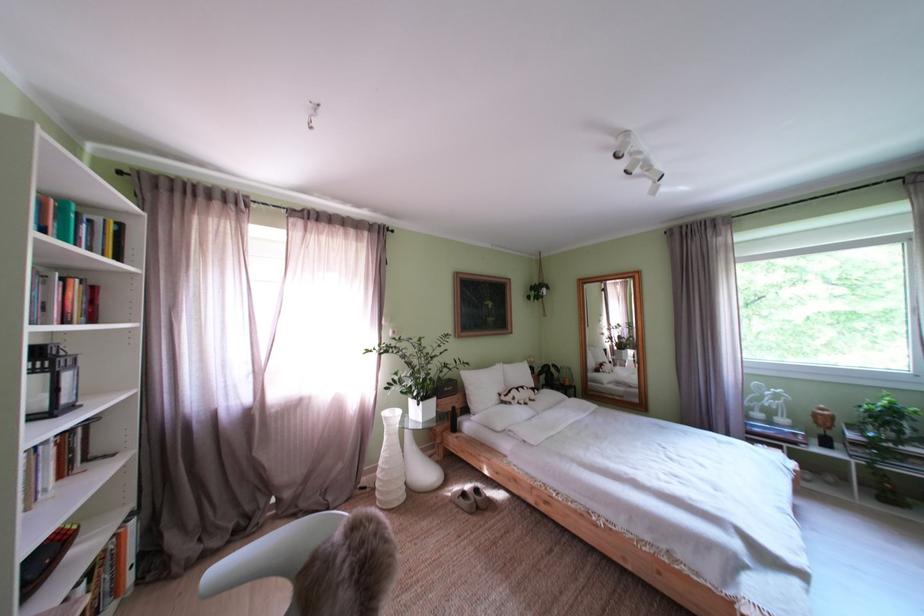
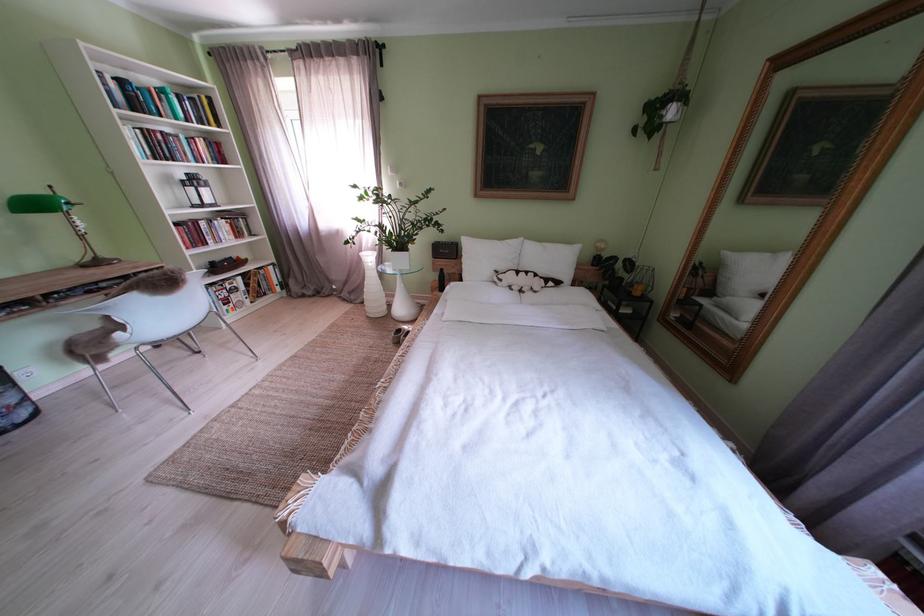
The point at (525, 405) is marked in the first image. Where is the corresponding point in the second image?

(512, 285)